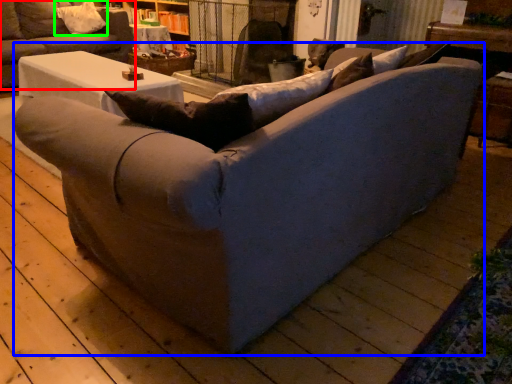
Question: Estimate the real-world distances between objects in this image. Which object is farther from studio couch (highlighted by a red box), studio couch (highlighted by a blue box) or pillow (highlighted by a green box)?

Choices:
 (A) studio couch
 (B) pillow

Answer: (A)